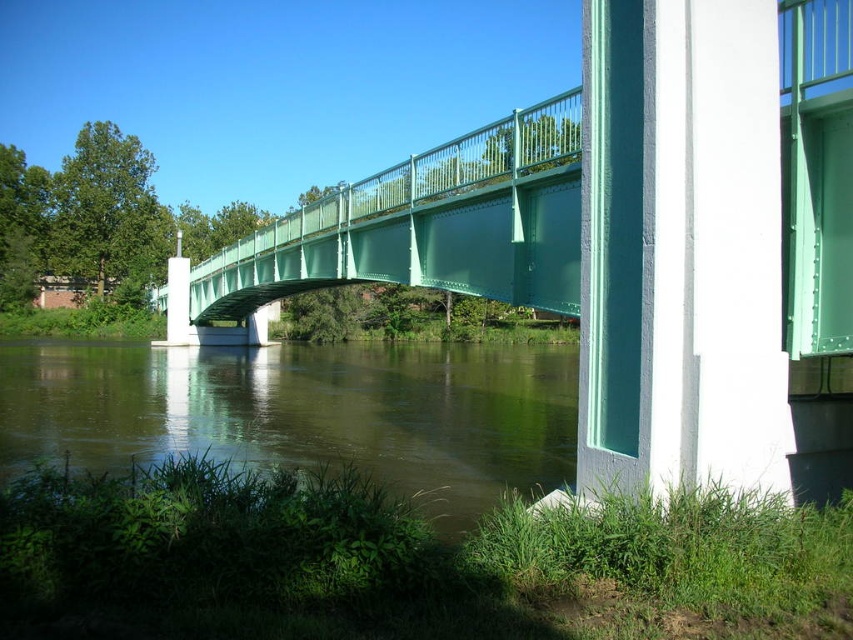
Question: Estimate the real-world distances between objects in this image. Which object is closer to the green painted steel bridge at center?

Choices:
 (A) green painted concrete pillar at center-right
 (B) brown/muddy water at lower center

Answer: (B)

Question: Which of the following is the closest to the observer?

Choices:
 (A) (204, 288)
 (B) (664, 86)

Answer: (B)

Question: Is green painted concrete pillar at center-right to the right of green painted steel bridge at center from the viewer's perspective?

Choices:
 (A) no
 (B) yes

Answer: (B)

Question: Is brown/muddy water at lower center bigger than green painted steel bridge at center?

Choices:
 (A) no
 (B) yes

Answer: (A)

Question: Which object appears closest to the camera in this image?

Choices:
 (A) green painted concrete pillar at center-right
 (B) green painted steel bridge at center

Answer: (A)

Question: Does brown/muddy water at lower center come in front of green painted steel bridge at center?

Choices:
 (A) no
 (B) yes

Answer: (A)